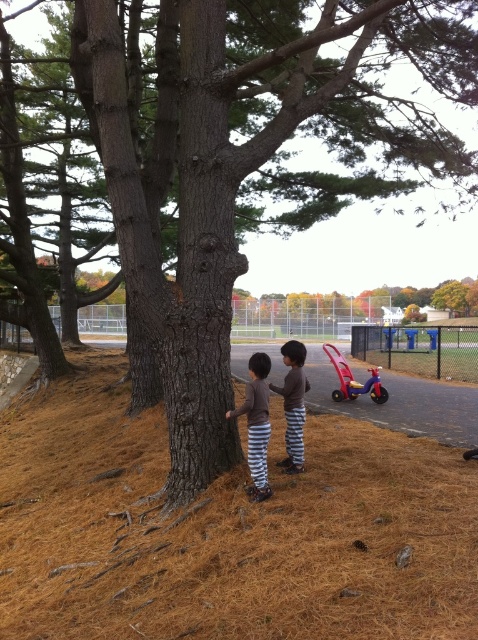
In the scene shown: You are standing at the point labeled as point (225, 531) in the image. What object are you directly in front of?

You are directly in front of the brown textured tree trunk at center, as the point (225, 531) represents its location.

You are a photographer trying to capture both the matte brown shirt at center and the brown cotton shirt at center in a single frame. Which shirt should you focus on first to ensure both are in the frame?

You should focus on the matte brown shirt at center first since it is shorter than the brown cotton shirt at center, allowing you to adjust the camera angle to include both.